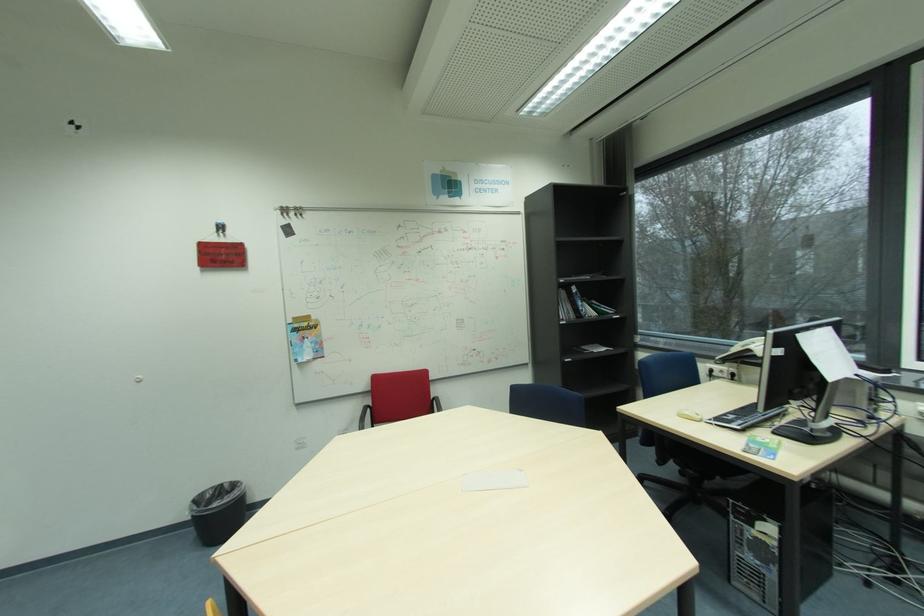
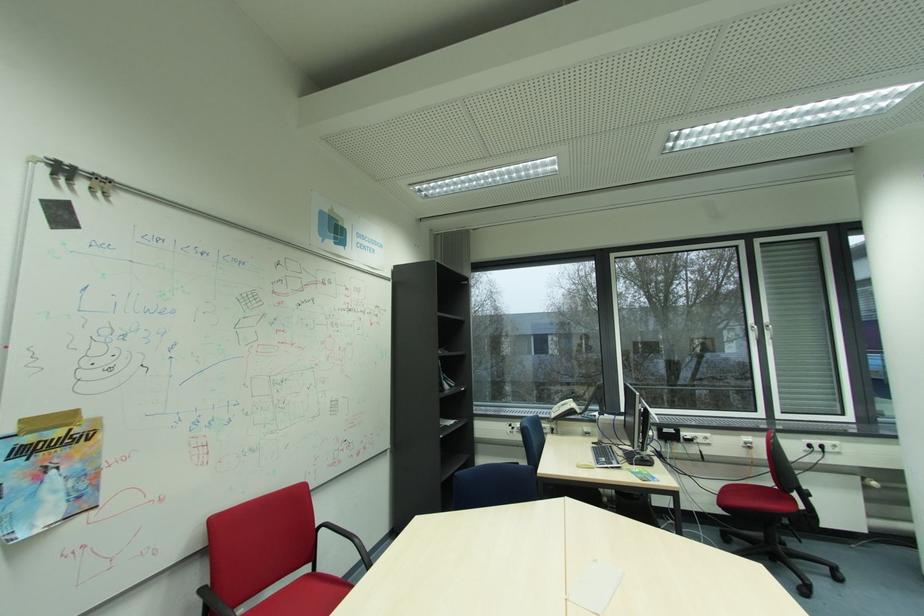
Where in the second image is the point corresponding to the point at 739,418 from the first image?

(611, 460)